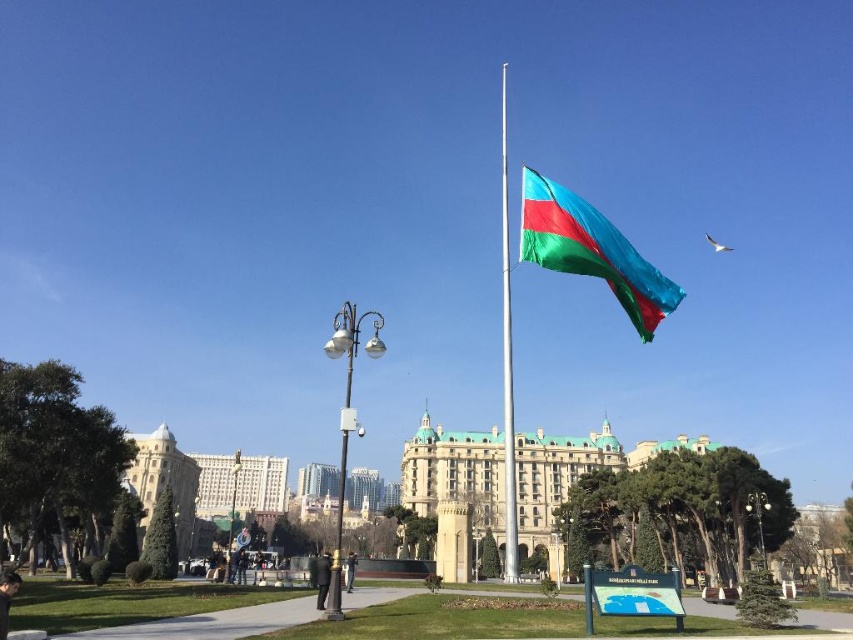
Question: Does dark brown leather jacket at lower left come behind polished metal streetlight at center?

Choices:
 (A) yes
 (B) no

Answer: (B)

Question: From the image, what is the correct spatial relationship of polished brass streetlight at center-left in relation to black leather pants at lower center?

Choices:
 (A) left
 (B) right

Answer: (B)

Question: Is polished silver flag pole at center thinner than matte black lamp post at center?

Choices:
 (A) no
 (B) yes

Answer: (A)

Question: Considering the real-world distances, which object is farthest from the polished metal streetlight at center?

Choices:
 (A) black leather pants at lower center
 (B) beige stone palace at center
 (C) polished brass streetlight at center-left

Answer: (C)

Question: Which object is the closest to the dark brown leather jacket at lower left?

Choices:
 (A) metallic streetlight at center
 (B) dark gray jeans at center
 (C) polished silver flag pole at center
 (D) polished brass streetlight at center-left

Answer: (B)

Question: Considering the real-world distances, which object is farthest from the polished brass streetlight at center-left?

Choices:
 (A) black leather pants at lower center
 (B) metallic streetlight at center

Answer: (B)